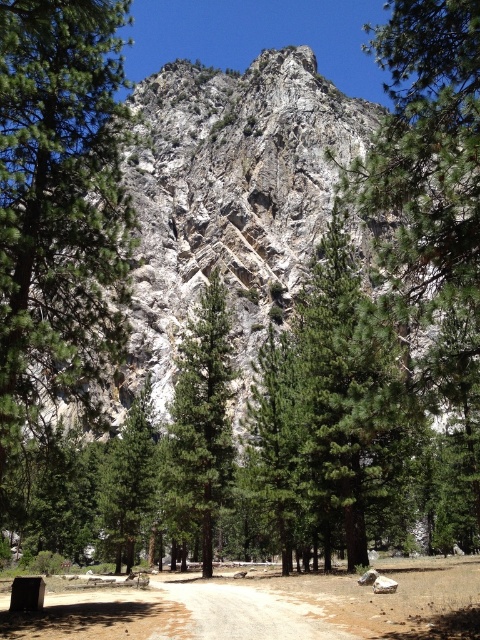
Question: Which is nearer to the green textured tree at center?

Choices:
 (A) brown dirt track at center
 (B) rocky cliff at center

Answer: (A)

Question: Which point appears farthest from the camera in this image?

Choices:
 (A) (76, 602)
 (B) (285, 76)

Answer: (B)

Question: Is rocky cliff at center further to the viewer compared to green textured tree at center?

Choices:
 (A) yes
 (B) no

Answer: (B)

Question: Can you confirm if rocky cliff at center is positioned to the right of brown dirt track at center?

Choices:
 (A) yes
 (B) no

Answer: (B)

Question: Which object appears farthest from the camera in this image?

Choices:
 (A) green textured tree at center
 (B) brown dirt track at center

Answer: (A)

Question: Is rocky cliff at center wider than brown dirt track at center?

Choices:
 (A) yes
 (B) no

Answer: (A)